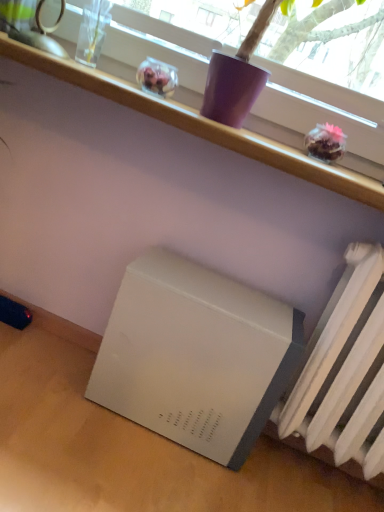
Question: From the image's perspective, would you say white plastic shelf at upper center is positioned over white matte refrigerator at lower left?

Choices:
 (A) no
 (B) yes

Answer: (B)

Question: From a real-world perspective, is white plastic shelf at upper center on white matte refrigerator at lower left?

Choices:
 (A) no
 (B) yes

Answer: (B)

Question: Can you confirm if white plastic shelf at upper center is taller than white matte refrigerator at lower left?

Choices:
 (A) no
 (B) yes

Answer: (A)

Question: Can you confirm if white plastic shelf at upper center is positioned to the left of white matte refrigerator at lower left?

Choices:
 (A) no
 (B) yes

Answer: (B)

Question: Is white plastic shelf at upper center shorter than white matte refrigerator at lower left?

Choices:
 (A) yes
 (B) no

Answer: (A)

Question: From their relative heights in the image, would you say white matte radiator at lower right is taller or shorter than white matte table at lower right?

Choices:
 (A) tall
 (B) short

Answer: (A)

Question: Considering the positions of white matte radiator at lower right and white matte table at lower right in the image, is white matte radiator at lower right bigger or smaller than white matte table at lower right?

Choices:
 (A) big
 (B) small

Answer: (A)

Question: Is white matte radiator at lower right to the left or to the right of white matte table at lower right in the image?

Choices:
 (A) right
 (B) left

Answer: (A)

Question: Do you think white matte radiator at lower right is within white matte table at lower right, or outside of it?

Choices:
 (A) inside
 (B) outside

Answer: (B)

Question: Is white matte refrigerator at lower left bigger or smaller than white matte table at lower right?

Choices:
 (A) big
 (B) small

Answer: (A)

Question: In the image, is white matte refrigerator at lower left positioned in front of or behind white matte table at lower right?

Choices:
 (A) behind
 (B) front

Answer: (A)

Question: Would you say white matte refrigerator at lower left is to the left or to the right of white matte table at lower right in the picture?

Choices:
 (A) left
 (B) right

Answer: (B)

Question: Is white matte refrigerator at lower left situated inside white matte table at lower right or outside?

Choices:
 (A) outside
 (B) inside

Answer: (A)

Question: Considering the positions of white matte radiator at lower right and white matte refrigerator at lower left in the image, is white matte radiator at lower right bigger or smaller than white matte refrigerator at lower left?

Choices:
 (A) big
 (B) small

Answer: (A)

Question: Choose the correct answer: Is white matte radiator at lower right inside white matte refrigerator at lower left or outside it?

Choices:
 (A) outside
 (B) inside

Answer: (A)